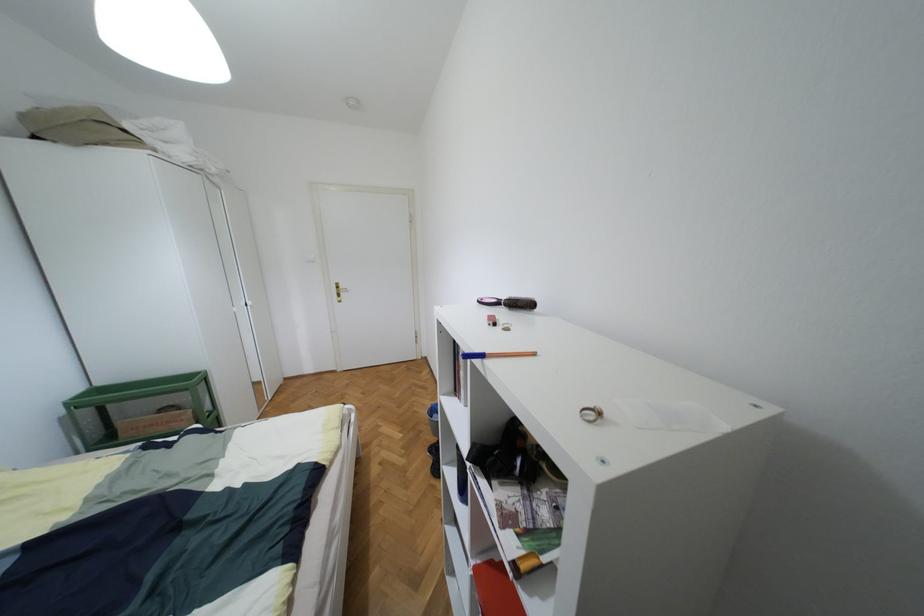
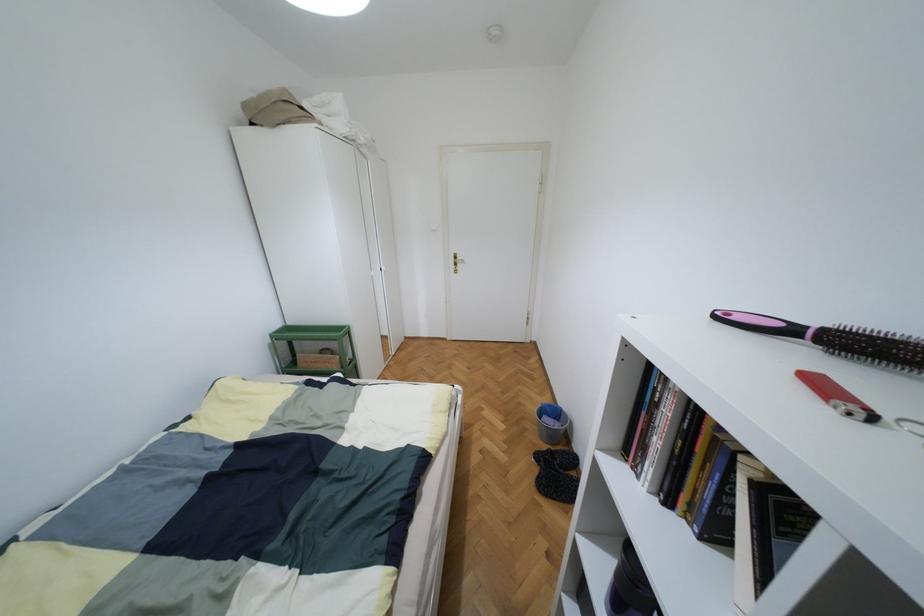
Find the pixel in the second image that matches the point at 490,322 in the first image.

(854, 408)